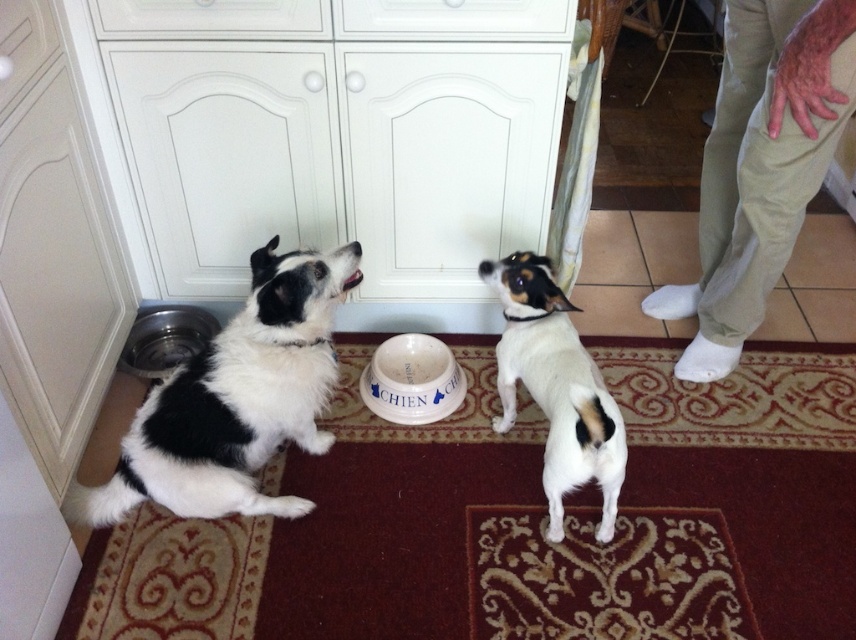
I want to click on white glossy cabinet at upper center, so click(x=339, y=140).

Image resolution: width=856 pixels, height=640 pixels. What do you see at coordinates (339, 140) in the screenshot? I see `white glossy cabinet at upper center` at bounding box center [339, 140].

Where is `white glossy cabinet at upper center`? This screenshot has height=640, width=856. white glossy cabinet at upper center is located at coordinates (339, 140).

Can you confirm if white fur dog at center is taller than white ceramic bowl at center?

Correct, white fur dog at center is much taller as white ceramic bowl at center.

This screenshot has width=856, height=640. What do you see at coordinates (556, 387) in the screenshot?
I see `white fur dog at center` at bounding box center [556, 387].

The height and width of the screenshot is (640, 856). What do you see at coordinates (556, 387) in the screenshot?
I see `white fur dog at center` at bounding box center [556, 387].

The image size is (856, 640). What are the coordinates of `white fur dog at center` in the screenshot? It's located at pos(556,387).

Does black and white fur dog at left have a lesser height compared to metallic silver bowl at lower left?

In fact, black and white fur dog at left may be taller than metallic silver bowl at lower left.

Who is positioned more to the right, black and white fur dog at left or metallic silver bowl at lower left?

Positioned to the right is black and white fur dog at left.

Who is more forward, (322, 259) or (165, 332)?

Point (322, 259) is more forward.

Find the location of `black and white fur dog at left`. black and white fur dog at left is located at coordinates (235, 401).